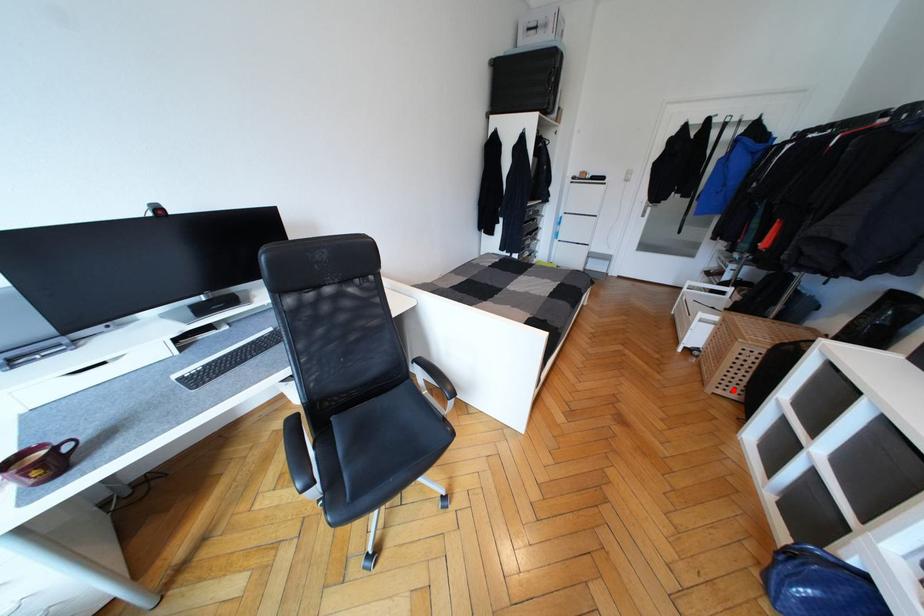
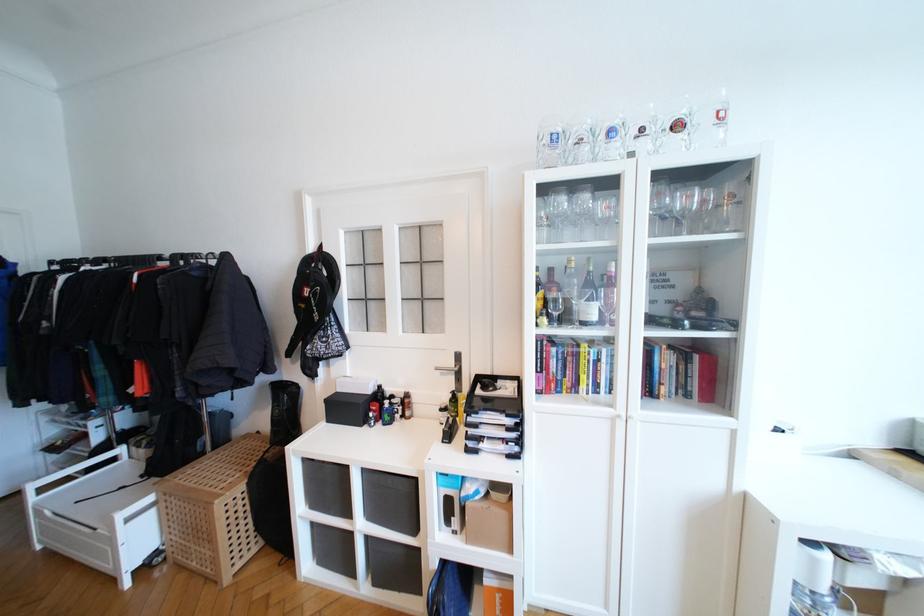
Locate, in the second image, the point that corresponds to the highlighted location in the first image.

(248, 551)